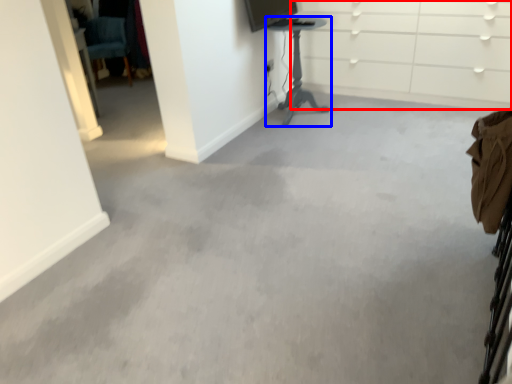
Question: Which point is further to the camera, dresser (highlighted by a red box) or furniture (highlighted by a blue box)?

Choices:
 (A) dresser
 (B) furniture

Answer: (B)